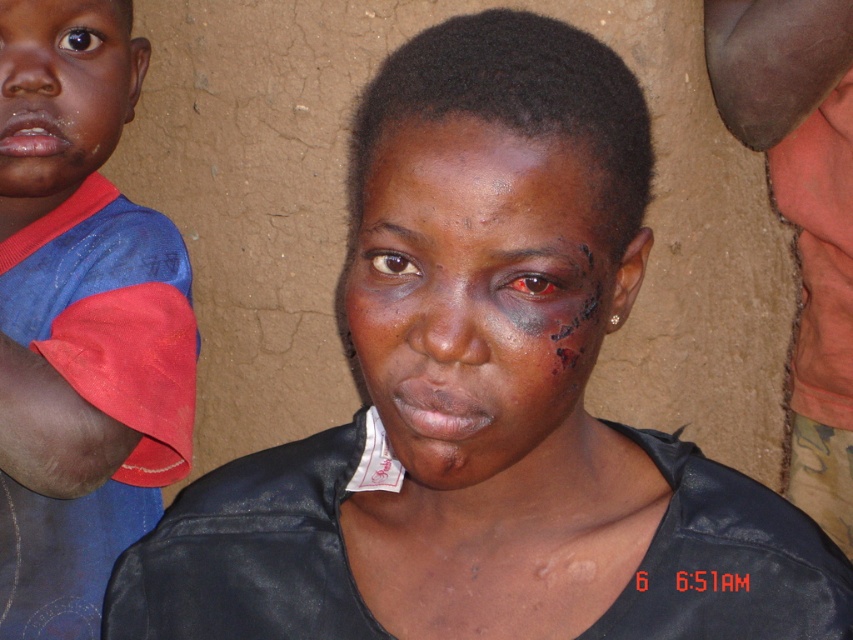
You are an observer looking at the image. You notice the blue cotton shirt at left and the matte skin face at center. Which object occupies a larger vertical space in the frame?

The blue cotton shirt at left is taller than the matte skin face at center, so it occupies a larger vertical space in the frame.

You are a photographer trying to adjust your camera focus. The scene has a woman in the center and part of another person at the left edge. There is a point marked at coordinates (80, 320). What object is located at this point?

The point at (80, 320) marks the blue cotton shirt at left.